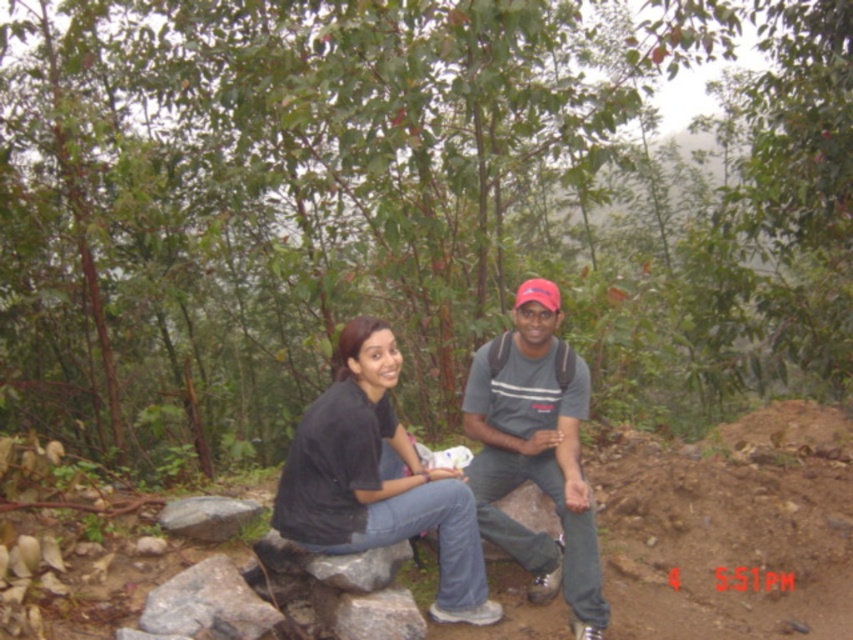
From the picture: You are standing in front of the two people in the forest. You want to place a small flag at the point closer to you between the two points labeled point (383, 545) and point (570, 422). Which point should you choose?

You should choose point (383, 545) because it is closer to the camera than point (570, 422).